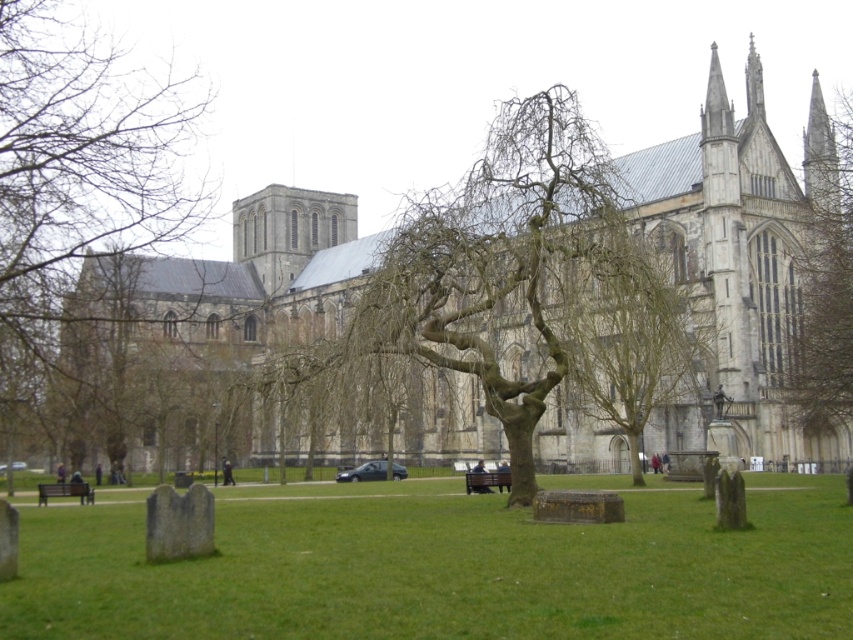
You are planning to place a new flower pot that is 1 meter wide between the bare branches at center and the wooden bench at lower left. Based on their widths, will the flower pot fit between them without overlapping?

The bare branches at center has a larger width than the wooden bench at lower left. Since the flower pot is 1 meter wide, it depends on the actual space between them. However, the description only provides relative width information, not the distance between the objects. Therefore, we cannot determine if the flower pot will fit solely based on the given information.

You are standing in front of the cathedral and want to take a photo of the tombstones in the foreground without the bare branches at right blocking the view. Where should you position yourself relative to the tombstones?

To avoid the bare branches at right blocking the view of the tombstones, you should position yourself to the left side of the tombstones since the branches are located at the right side of the image.

You are visiting the historic cathedral and want to sit down to rest. You see the bare branches at center and the wooden bench at lower left. Which object is bigger in size?

The bare branches at center has a larger size compared to the wooden bench at lower left.